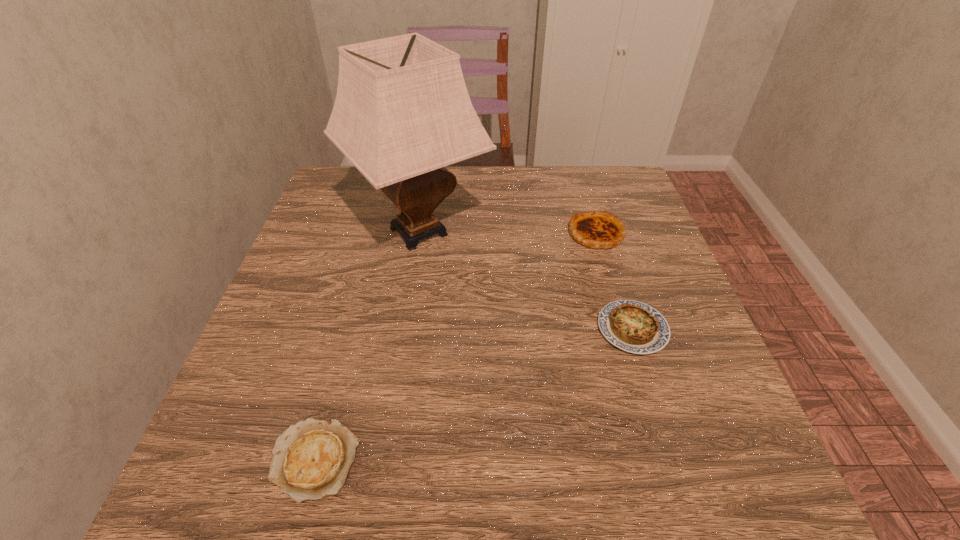
In the image, there is a desktop. Identify the location of vacant space at the far left corner. The image size is (960, 540). (326, 193).

This screenshot has height=540, width=960. Find the location of `vacant space at the far right corner`. vacant space at the far right corner is located at coordinates (617, 206).

Where is `free space between the third shortest object and the shortest object`? This screenshot has height=540, width=960. free space between the third shortest object and the shortest object is located at coordinates (455, 347).

Where is `free space between the farthest quiche and the shortest object`? free space between the farthest quiche and the shortest object is located at coordinates (455, 347).

Locate an element on the screen. The height and width of the screenshot is (540, 960). vacant area between the farthest quiche and the nearest quiche is located at coordinates (455, 347).

Locate an element on the screen. Image resolution: width=960 pixels, height=540 pixels. vacant region between the farthest quiche and the lampshade is located at coordinates pos(508,232).

Where is `free spot between the second nearest quiche and the tallest object`? Image resolution: width=960 pixels, height=540 pixels. free spot between the second nearest quiche and the tallest object is located at coordinates (525, 280).

Locate an element on the screen. The width and height of the screenshot is (960, 540). vacant space that's between the tallest object and the second shortest object is located at coordinates (525, 280).

The height and width of the screenshot is (540, 960). Identify the location of free space that is in between the tallest object and the third shortest object. (508, 232).

Find the location of `empty space that is in between the lampshade and the nearest quiche`. empty space that is in between the lampshade and the nearest quiche is located at coordinates (367, 346).